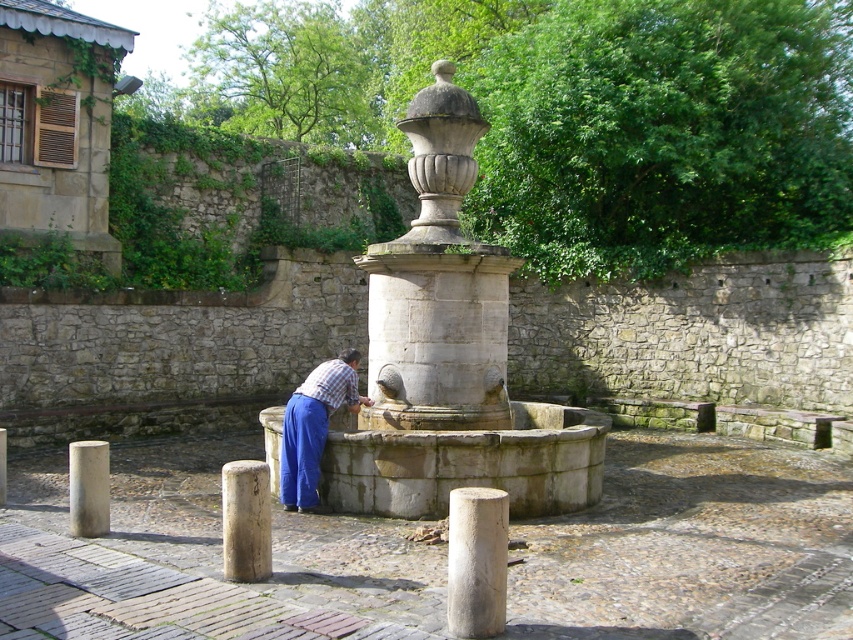
What do you see at coordinates (245, 520) in the screenshot? I see `smooth stone post at lower left` at bounding box center [245, 520].

Is smooth stone post at lower left wider than smooth gray stone pillar at center?

Yes, smooth stone post at lower left is wider than smooth gray stone pillar at center.

Which is behind, point (251, 496) or point (1, 497)?

The point (1, 497) is behind.

Locate an element on the screen. smooth stone post at lower left is located at coordinates (245, 520).

Which is more to the left, checkered fabric shirt at center or smooth gray post at lower left?

From the viewer's perspective, smooth gray post at lower left appears more on the left side.

Which is behind, point (316, 396) or point (97, 525)?

The point (316, 396) is behind.

You are a GUI agent. You are given a task and a screenshot of the screen. Output one action in this format:
    pyautogui.click(x=<x>, y=<y>)
    Task: Click on the checkered fabric shirt at center
    This screenshot has width=853, height=640.
    Given the screenshot: What is the action you would take?
    [314, 428]

Does point (474, 600) come closer to viewer compared to point (3, 474)?

Yes, it is.

Does white stone pillar at center have a lesser width compared to smooth gray stone pillar at center?

Incorrect, white stone pillar at center's width is not less than smooth gray stone pillar at center's.

Does point (462, 636) come closer to viewer compared to point (1, 454)?

That is True.

You are a GUI agent. You are given a task and a screenshot of the screen. Output one action in this format:
    pyautogui.click(x=<x>, y=<y>)
    Task: Click on the white stone pillar at center
    Image resolution: width=853 pixels, height=640 pixels.
    Given the screenshot: What is the action you would take?
    pyautogui.click(x=476, y=561)